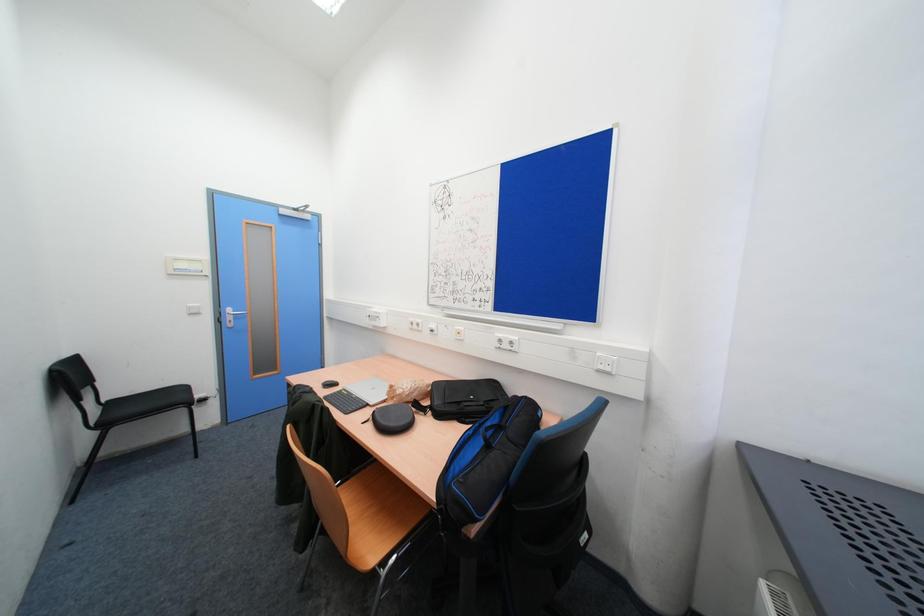
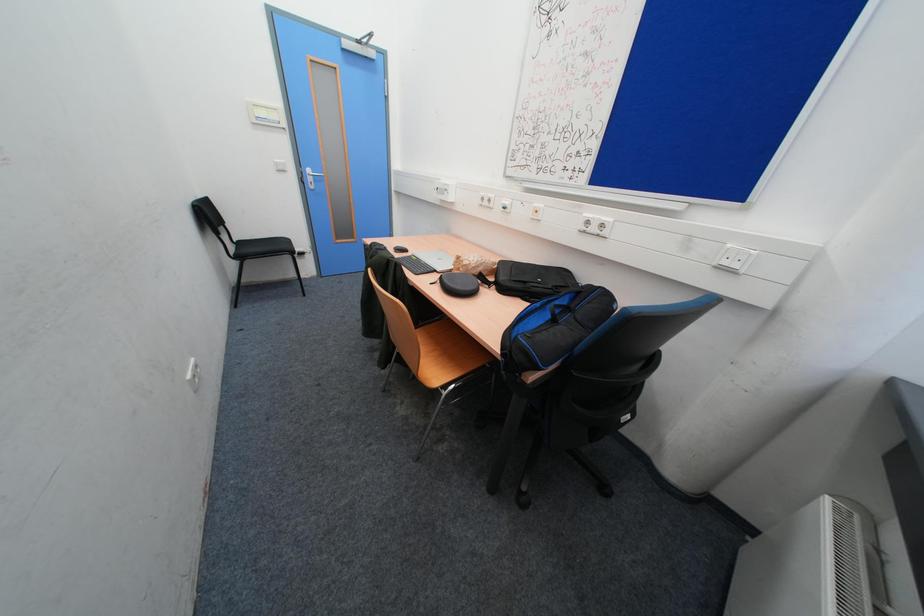
In a continuous first-person perspective shot, in which direction is the camera moving?

The movement direction of the cameraman is left, forward.